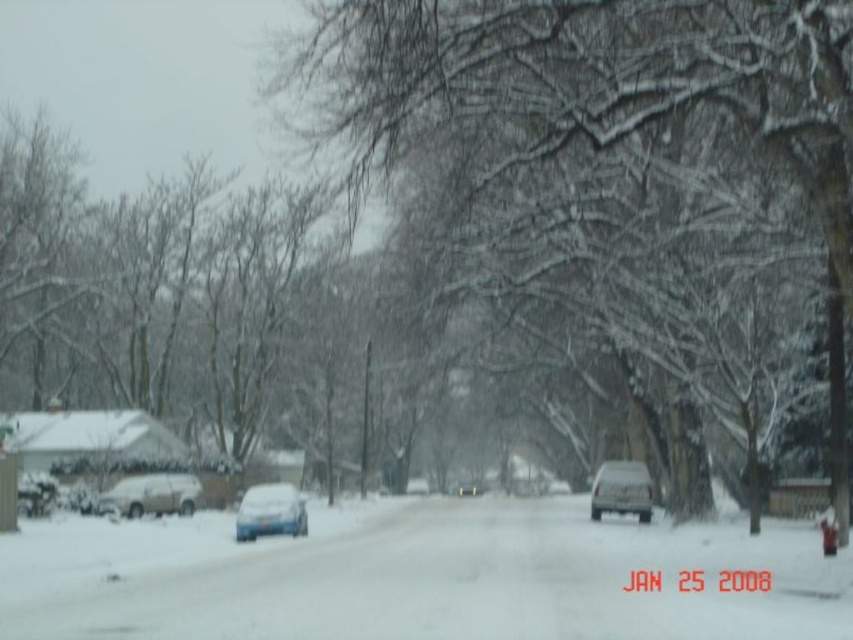
Question: Is matte blue car at center wider than matte silver truck at center?

Choices:
 (A) no
 (B) yes

Answer: (B)

Question: Among these objects, which one is farthest from the camera?

Choices:
 (A) matte silver truck at center
 (B) white matte suv at left
 (C) matte blue car at center
 (D) white powdery snow at center

Answer: (B)

Question: Which object is positioned farthest from the snow-covered branches at center?

Choices:
 (A) matte silver truck at center
 (B) white matte suv at left
 (C) matte blue car at center
 (D) white powdery snow at center

Answer: (B)

Question: Which object appears farthest from the camera in this image?

Choices:
 (A) matte silver truck at center
 (B) snow-covered branches at center
 (C) white matte suv at left
 (D) matte blue car at center

Answer: (C)

Question: Does white powdery snow at center have a greater width compared to white matte suv at left?

Choices:
 (A) yes
 (B) no

Answer: (A)

Question: Is matte blue car at center positioned behind matte silver truck at center?

Choices:
 (A) no
 (B) yes

Answer: (A)